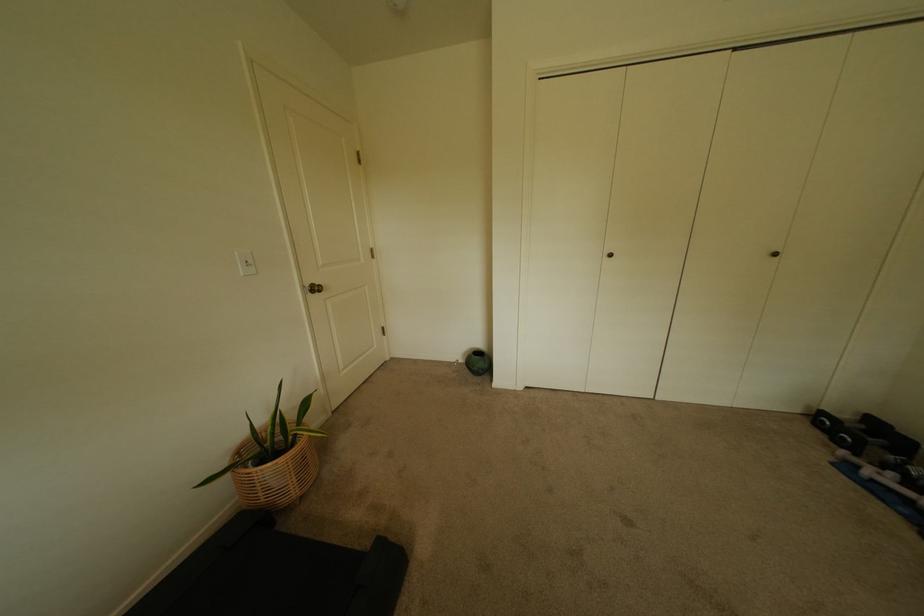
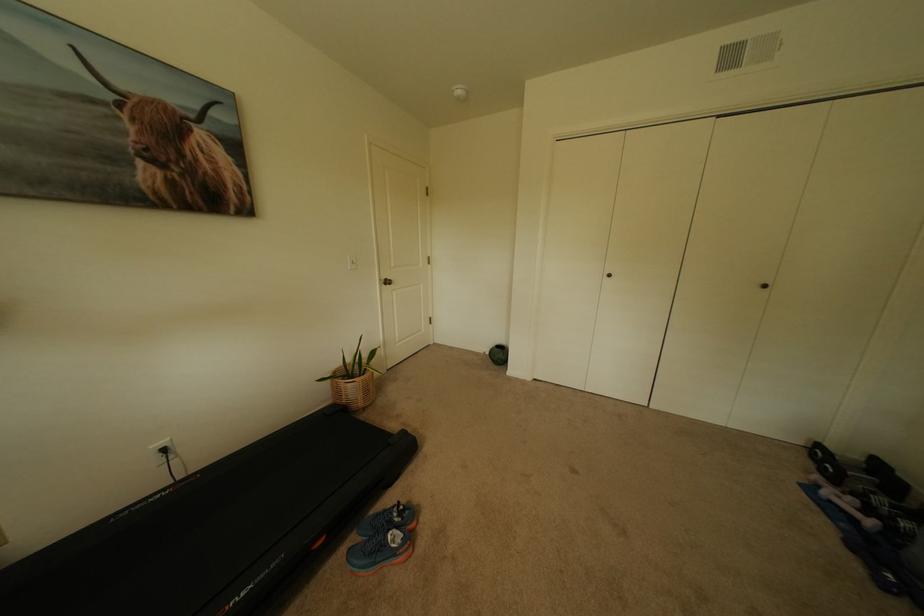
The images are taken continuously from a first-person perspective. In which direction are you moving?

The cameraman walked toward right, backward.